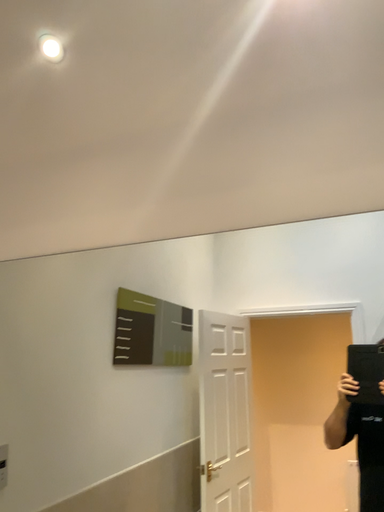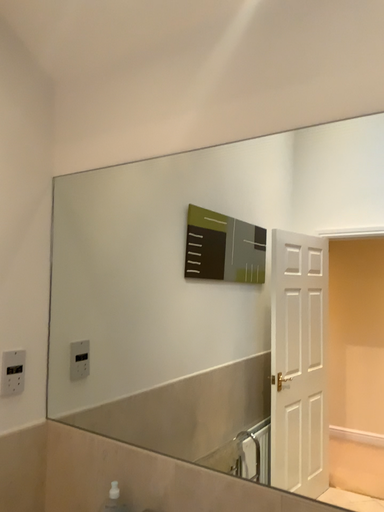
Question: Which way did the camera rotate in the video?

Choices:
 (A) rotated left
 (B) rotated right

Answer: (A)